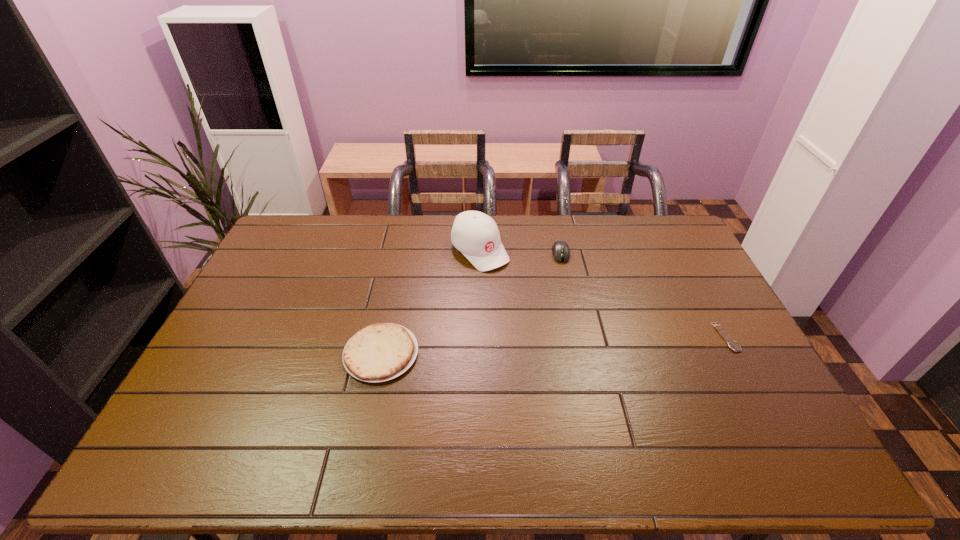
Identify the location of free space located 0.320m on the wheel side of the computer mouse. (573, 333).

Identify the location of free region located 0.220m on the front-facing side of the baseball cap. Image resolution: width=960 pixels, height=540 pixels. (535, 307).

At what (x,y) coordinates should I click in order to perform the action: click on vacant region located on the front-facing side of the baseball cap. Please return your answer as a coordinate pair (x, y). The image size is (960, 540). Looking at the image, I should click on (537, 309).

Locate an element on the screen. free space located 0.400m on the front-facing side of the baseball cap is located at coordinates (572, 345).

Identify the location of computer mouse present at the far edge. The height and width of the screenshot is (540, 960). (560, 249).

The width and height of the screenshot is (960, 540). I want to click on baseball cap that is at the far edge, so click(475, 234).

Image resolution: width=960 pixels, height=540 pixels. Find the location of `object present at the right edge`. object present at the right edge is located at coordinates (733, 345).

Find the location of a particular element. The image size is (960, 540). free space at the far edge of the desktop is located at coordinates (447, 228).

In the image, there is a desktop. In order to click on vacant area at the near edge in this screenshot , I will do `click(524, 411)`.

The height and width of the screenshot is (540, 960). I want to click on free space at the left edge of the desktop, so click(x=241, y=322).